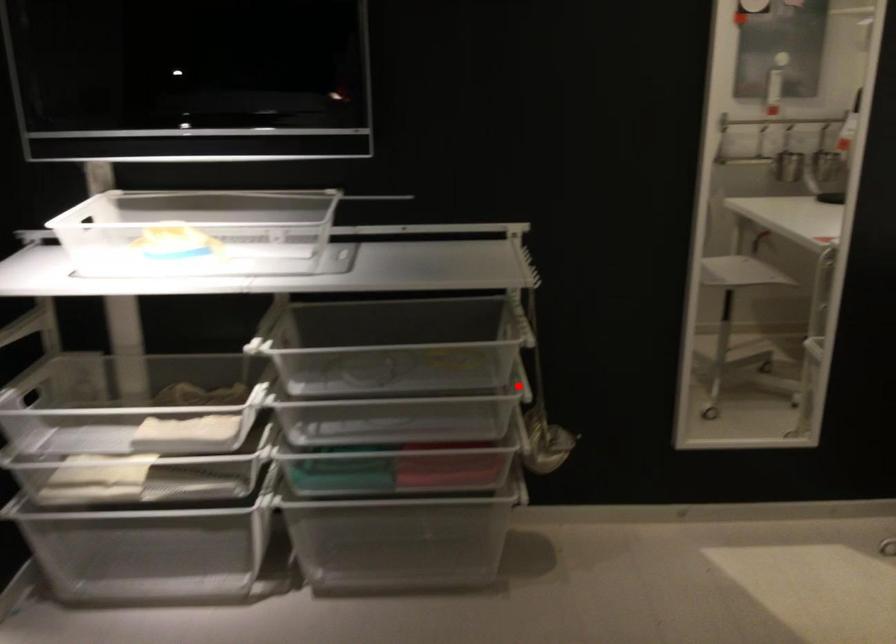
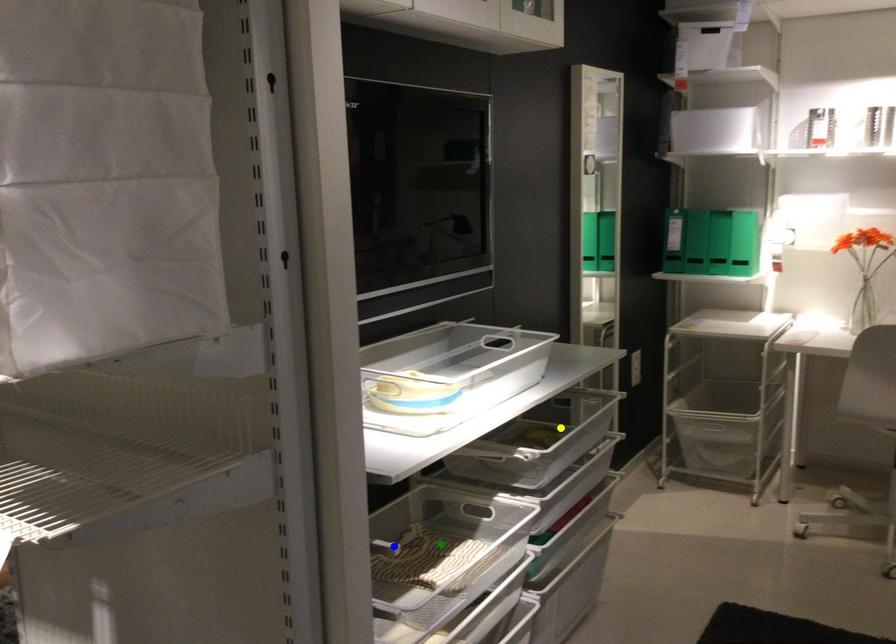
Question: I am providing you with two images of the same scene from different viewpoints. A red point is marked on the first image. You are given multiple points on the second image. In image 2, which mark is for the same physical point as the one in image 1?

Choices:
 (A) yellow point
 (B) blue point
 (C) green point

Answer: (A)